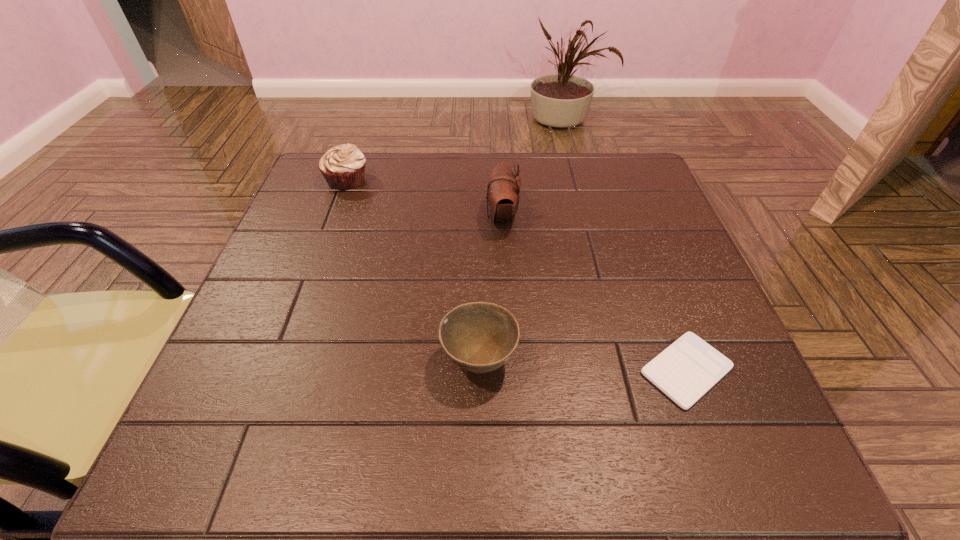
Where is `vacant area between the rightmost object and the farthest object`? The width and height of the screenshot is (960, 540). vacant area between the rightmost object and the farthest object is located at coordinates point(516,275).

You are a GUI agent. You are given a task and a screenshot of the screen. Output one action in this format:
    pyautogui.click(x=<x>, y=<y>)
    Task: Click on the free space between the bowl and the shortest object
    This screenshot has height=540, width=960.
    Given the screenshot: What is the action you would take?
    pyautogui.click(x=583, y=365)

The height and width of the screenshot is (540, 960). Find the location of `vacant space that's between the tallest object and the bowl`. vacant space that's between the tallest object and the bowl is located at coordinates (491, 288).

Find the location of a particular element. vacant region between the tallest object and the farthest object is located at coordinates (424, 198).

Identify which object is located as the third nearest to the shortest object. Please provide its 2D coordinates. Your answer should be formatted as a tuple, i.e. [(x, y)], where the tuple contains the x and y coordinates of a point satisfying the conditions above.

[(343, 166)]

I want to click on the second closest object to the tallest object, so click(x=343, y=166).

The height and width of the screenshot is (540, 960). Identify the location of free space that satisfies the following two spatial constraints: 1. with the flap open on the pouch; 2. on the right side of the shortest object. (511, 370).

Locate an element on the screen. The height and width of the screenshot is (540, 960). free spot that satisfies the following two spatial constraints: 1. with the flap open on the third nearest object; 2. on the left side of the calculator is located at coordinates (511, 370).

What are the coordinates of `free spot that satisfies the following two spatial constraints: 1. with the flap open on the third nearest object; 2. on the right side of the rightmost object` in the screenshot? It's located at (511, 370).